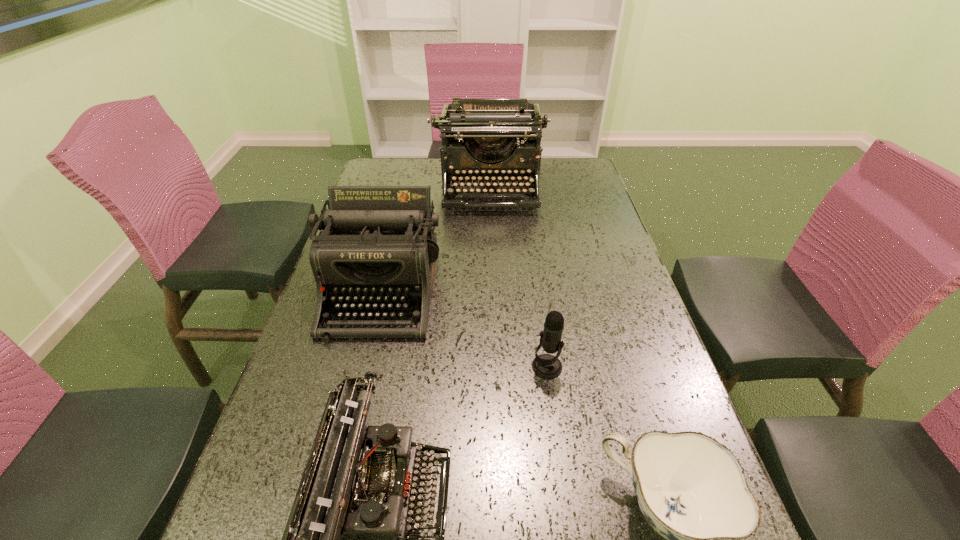
The width and height of the screenshot is (960, 540). I want to click on the farthest object, so click(479, 140).

At what (x,y) coordinates should I click in order to perform the action: click on the fourth nearest object. Please return your answer as a coordinate pair (x, y). Image resolution: width=960 pixels, height=540 pixels. Looking at the image, I should click on (378, 245).

Find the location of a particular element. This screenshot has height=540, width=960. the third farthest object is located at coordinates (547, 366).

Identify the location of vacant point located on the typing side of the farthest typewriter. (492, 261).

Locate an element on the screen. The image size is (960, 540). blank space located 0.280m on the keyboard of the second farthest object is located at coordinates (338, 464).

This screenshot has height=540, width=960. In order to click on vacant space located on the back of the third nearest object in this screenshot , I will do `click(535, 278)`.

Where is `object located at the far edge`? This screenshot has width=960, height=540. object located at the far edge is located at coordinates (479, 140).

Identify the location of object that is at the left edge. This screenshot has height=540, width=960. (378, 245).

Image resolution: width=960 pixels, height=540 pixels. Find the location of `object located in the right edge section of the desktop`. object located in the right edge section of the desktop is located at coordinates (479, 140).

This screenshot has width=960, height=540. Find the location of `object situated at the far right corner`. object situated at the far right corner is located at coordinates (479, 140).